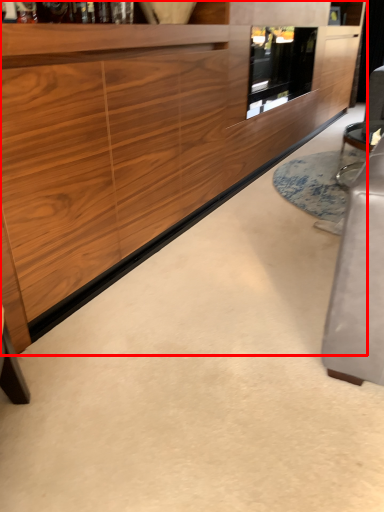
Question: From the image's perspective, what is the correct spatial relationship of cabinetry (annotated by the red box) in relation to glass door?

Choices:
 (A) below
 (B) above

Answer: (A)